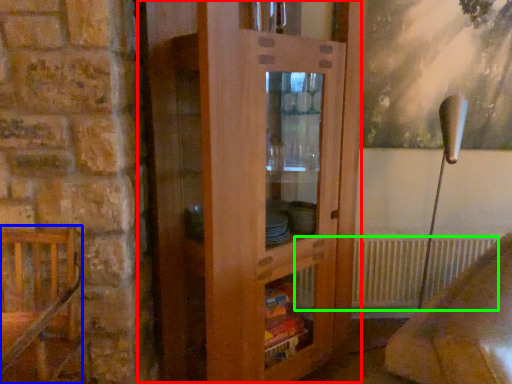
Question: Considering the real-world distances, which object is farthest from dresser (highlighted by a red box)? furniture (highlighted by a blue box) or radiator (highlighted by a green box)?

Choices:
 (A) furniture
 (B) radiator

Answer: (B)